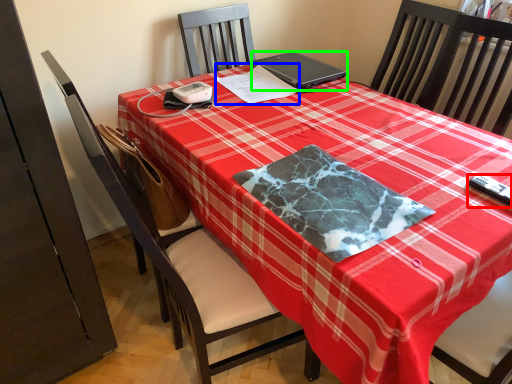
Question: Which object is the closest to the remote control (highlighted by a red box)? Choose among these: notepad (highlighted by a blue box) or laptop (highlighted by a green box).

Choices:
 (A) notepad
 (B) laptop

Answer: (A)